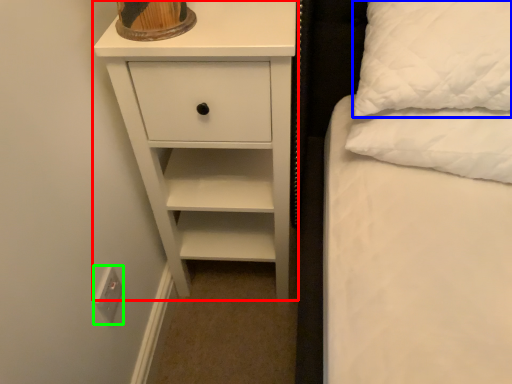
Question: Estimate the real-world distances between objects in this image. Which object is closer to chest of drawers (highlighted by a red box), pillow (highlighted by a blue box) or electric outlet (highlighted by a green box)?

Choices:
 (A) pillow
 (B) electric outlet

Answer: (A)